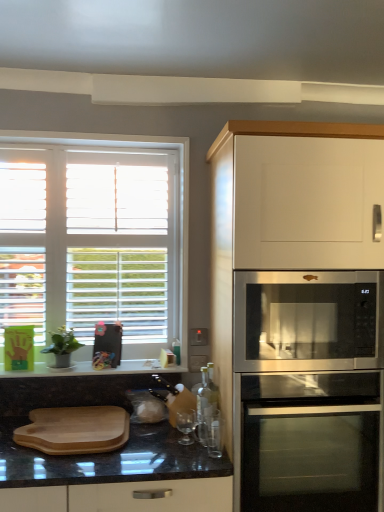
The width and height of the screenshot is (384, 512). I want to click on stainless steel oven at lower right, so click(x=310, y=442).

The width and height of the screenshot is (384, 512). What do you see at coordinates (305, 320) in the screenshot? I see `stainless steel microwave at right` at bounding box center [305, 320].

Find the location of a particular element. This screenshot has height=512, width=384. wooden cutting board at lower left is located at coordinates (75, 430).

What is the approximate width of white wood window at upper left?

The width of white wood window at upper left is 5.32 inches.

In order to click on clear glass bottle at center in this screenshot , I will do `click(205, 402)`.

The width and height of the screenshot is (384, 512). I want to click on white matte cabinet at upper right, so click(x=300, y=312).

Locate an element on the screen. stainless steel oven at lower right is located at coordinates (310, 442).

Is the position of clear glass bottle at center less distant than that of stainless steel oven at lower right?

That is False.

Between point (205, 433) and point (241, 469), which one is positioned in front?

Point (241, 469)

How many degrees apart are the facing directions of clear glass bottle at center and stainless steel oven at lower right?

There is a 89.5-degree angle between the facing directions of clear glass bottle at center and stainless steel oven at lower right.

The image size is (384, 512). I want to click on bottle on the left of stainless steel oven at lower right, so click(205, 402).

Is point (299, 448) positioned after point (222, 424)?

No, it is not.

This screenshot has width=384, height=512. What are the coordinates of `cabinetry above the clear glass at lower center (from the image's perspective)` in the screenshot? It's located at (300, 312).

Based on the photo, are white matte cabinet at upper right and clear glass at lower center far apart?

That's not correct — white matte cabinet at upper right is a little close to clear glass at lower center.

Can we say stainless steel oven at lower right lies outside white matte cabinet at upper right?

No, stainless steel oven at lower right is inside white matte cabinet at upper right's boundary.

Could you tell me if stainless steel oven at lower right is turned towards white matte cabinet at upper right?

Yes, stainless steel oven at lower right is turned towards white matte cabinet at upper right.

From a real-world perspective, between stainless steel oven at lower right and white matte cabinet at upper right, who is vertically lower?

From a 3D spatial view, stainless steel oven at lower right is below.

How many degrees apart are the facing directions of stainless steel oven at lower right and white matte cabinet at upper right?

The facing directions of stainless steel oven at lower right and white matte cabinet at upper right are 0.103 degrees apart.

Would you consider granite black countertop at lower center to be distant from white wood window at upper left?

Actually, granite black countertop at lower center and white wood window at upper left are a little close together.

Measure the distance between granite black countertop at lower center and white wood window at upper left.

granite black countertop at lower center and white wood window at upper left are 21.65 inches apart.

Is granite black countertop at lower center not within white wood window at upper left?

granite black countertop at lower center lies outside white wood window at upper left's area.

Considering the sizes of objects granite black countertop at lower center and white wood window at upper left in the image provided, who is shorter, granite black countertop at lower center or white wood window at upper left?

granite black countertop at lower center is shorter.

Is white wood window at upper left next to white matte cabinet at upper right and touching it?

white wood window at upper left is not next to white matte cabinet at upper right, and they're not touching.

Is white wood window at upper left smaller than white matte cabinet at upper right?

Correct, white wood window at upper left occupies less space than white matte cabinet at upper right.

The image size is (384, 512). There is a white matte cabinet at upper right. In order to click on window above it (from a real-world perspective) in this screenshot , I will do `click(96, 237)`.

Considering the sizes of objects white wood window at upper left and white matte cabinet at upper right in the image provided, who is shorter, white wood window at upper left or white matte cabinet at upper right?

Standing shorter between the two is white wood window at upper left.

Between clear glass at lower center and stainless steel oven at lower right, which one has less height?

clear glass at lower center is shorter.

In the scene shown: Which point is more distant from viewer, (219, 437) or (260, 392)?

The point (219, 437) is behind.

Is the surface of clear glass at lower center in direct contact with stainless steel oven at lower right?

No, clear glass at lower center is not beside stainless steel oven at lower right.

Is clear glass at lower center spatially inside stainless steel oven at lower right, or outside of it?

clear glass at lower center is outside stainless steel oven at lower right.

Can you confirm if clear glass at lower center is thinner than wooden cutting board at lower left?

A: Yes.

Between point (209, 419) and point (93, 448), which one is positioned behind?

Positioned behind is point (209, 419).

At what (x,y) coordinates should I click in order to perform the action: click on cutting board that is on the left side of clear glass at lower center. Please return your answer as a coordinate pair (x, y). Looking at the image, I should click on click(75, 430).

Is clear glass at lower center inside or outside of wooden cutting board at lower left?

clear glass at lower center is spatially situated outside wooden cutting board at lower left.

Find the location of a particular element. bottle above the stainless steel oven at lower right (from a real-world perspective) is located at coordinates (205, 402).

Find the location of a particular element. This screenshot has height=512, width=384. cabinetry above the clear glass at lower center (from the image's perspective) is located at coordinates (300, 312).

From the image, which object appears to be nearer to granite black countertop at lower center, stainless steel oven at lower right or clear glass bottle at center?

clear glass bottle at center is closer to granite black countertop at lower center.

Considering their positions, is stainless steel microwave at right positioned closer to clear glass bottle at center than stainless steel oven at lower right?

Among the two, stainless steel oven at lower right is located nearer to clear glass bottle at center.

From the image, which object appears to be farther from white wood window at upper left, granite black countertop at lower center or stainless steel oven at lower right?

The object further to white wood window at upper left is stainless steel oven at lower right.

Looking at this image, estimate the real-world distances between objects in this image. Which object is closer to wooden cutting board at lower left, stainless steel microwave at right or stainless steel oven at lower right?

Among the two, stainless steel oven at lower right is located nearer to wooden cutting board at lower left.

From the picture: Estimate the real-world distances between objects in this image. Which object is closer to stainless steel oven at lower right, white matte cabinet at upper right or white wood window at upper left?

Among the two, white matte cabinet at upper right is located nearer to stainless steel oven at lower right.

Based on their spatial positions, is granite black countertop at lower center or clear glass at lower center closer to white wood window at upper left?

granite black countertop at lower center lies closer to white wood window at upper left than the other object.

Based on the photo, when comparing their distances from white wood window at upper left, does clear glass at lower center or stainless steel microwave at right seem closer?

stainless steel microwave at right is positioned closer to the anchor white wood window at upper left.

Which object lies nearer to the anchor point granite black countertop at lower center, white matte cabinet at upper right or clear glass bottle at center?

clear glass bottle at center.

You are a GUI agent. You are given a task and a screenshot of the screen. Output one action in this format:
    pyautogui.click(x=<x>, y=<y>)
    Task: Click on the appliance between stainless steel microwave at right and stainless steel oven at lower right vertically
    
    Given the screenshot: What is the action you would take?
    pyautogui.click(x=215, y=436)

Where is `microwave oven between wooden cutting board at lower left and white matte cabinet at upper right in the horizontal direction`? The width and height of the screenshot is (384, 512). microwave oven between wooden cutting board at lower left and white matte cabinet at upper right in the horizontal direction is located at coordinates point(305,320).

I want to click on oven between granite black countertop at lower center and stainless steel microwave at right, so (310, 442).

Image resolution: width=384 pixels, height=512 pixels. Find the location of `bottle between stainless steel microwave at right and clear glass at lower center in the up-down direction`. bottle between stainless steel microwave at right and clear glass at lower center in the up-down direction is located at coordinates (205, 402).